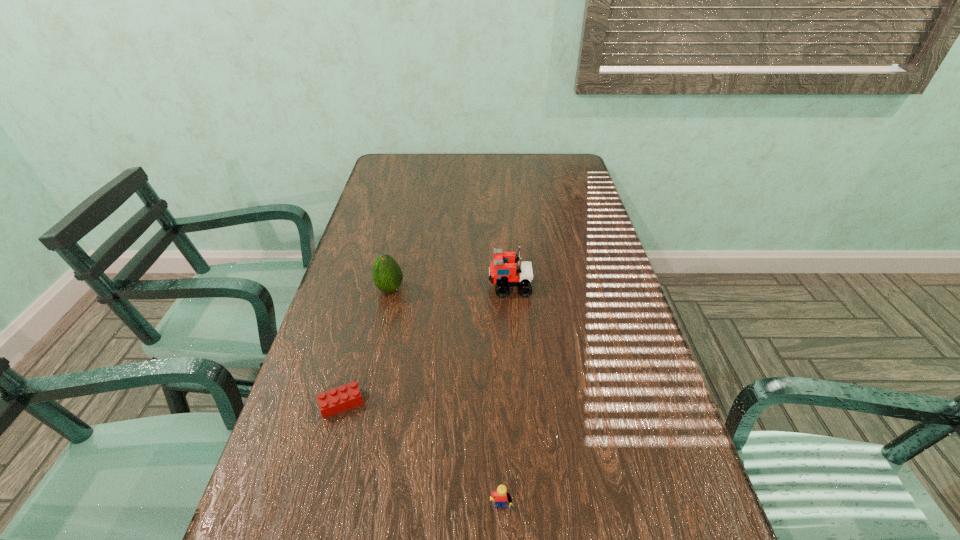
I want to click on free area in between the avocado and the nearest object, so click(446, 402).

You are a GUI agent. You are given a task and a screenshot of the screen. Output one action in this format:
    pyautogui.click(x=<x>, y=<y>)
    Task: Click on the free space between the avocado and the second nearest object
    The width and height of the screenshot is (960, 540).
    Given the screenshot: What is the action you would take?
    (x=366, y=347)

The height and width of the screenshot is (540, 960). Identify the location of blank region between the shortest Lego and the tallest Lego. (426, 345).

Locate an element on the screen. This screenshot has width=960, height=540. vacant region between the avocado and the second nearest Lego is located at coordinates (366, 347).

Locate an element on the screen. The image size is (960, 540). free spot between the avocado and the shortest object is located at coordinates (366, 347).

Identify the location of unoccupied area between the third tallest object and the farthest Lego. The width and height of the screenshot is (960, 540). (506, 400).

Find the location of a particular element. The width and height of the screenshot is (960, 540). vacant area that lies between the avocado and the tallest Lego is located at coordinates (450, 288).

You are a GUI agent. You are given a task and a screenshot of the screen. Output one action in this format:
    pyautogui.click(x=<x>, y=<y>)
    Task: Click on the vacant area between the shortest Lego and the nearest object
    The height and width of the screenshot is (540, 960).
    Given the screenshot: What is the action you would take?
    pyautogui.click(x=421, y=459)

The image size is (960, 540). What are the coordinates of `object that is the second closest to the avocado` in the screenshot? It's located at (334, 401).

Locate which object ranks in proximity to the second farthest Lego. Please provide its 2D coordinates. Your answer should be formatted as a tuple, i.e. [(x, y)], where the tuple contains the x and y coordinates of a point satisfying the conditions above.

[(387, 275)]